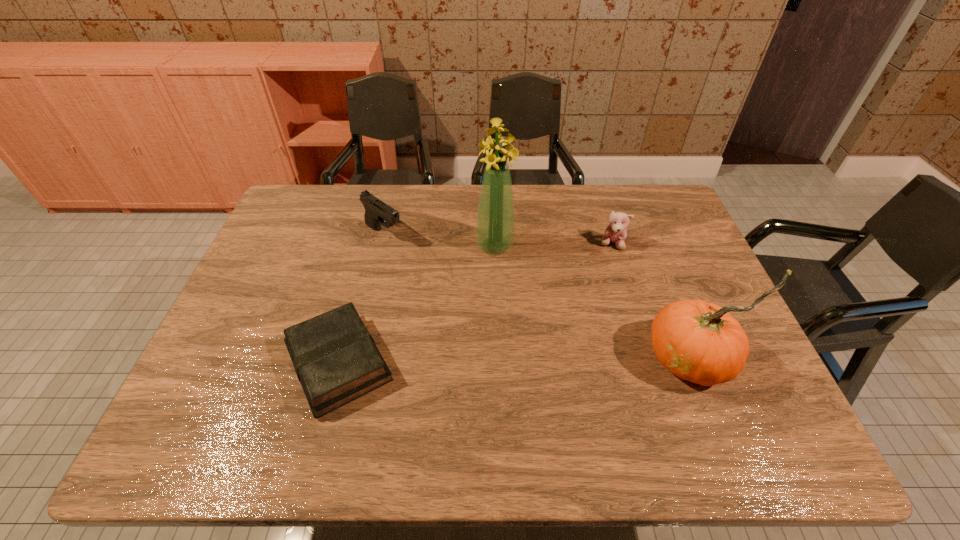
Identify the location of book. (336, 360).

Find the location of `pumpkin`. pumpkin is located at coordinates (701, 342).

Identify the location of the third object from right to left. (495, 226).

Locate an element on the screen. The image size is (960, 540). the tallest object is located at coordinates (495, 226).

Where is `teddy bear`? The height and width of the screenshot is (540, 960). teddy bear is located at coordinates (616, 233).

I want to click on pistol, so click(376, 211).

Where is `vacant space situated 0.230m on the right of the book`? vacant space situated 0.230m on the right of the book is located at coordinates coord(491,362).

I want to click on vacant space located 0.370m on the back of the fourth shortest object, so click(641, 233).

The height and width of the screenshot is (540, 960). I want to click on free space located on the front-facing side of the third object from left to right, so click(528, 369).

Identify the location of free space located on the front-facing side of the third object from left to right. (523, 352).